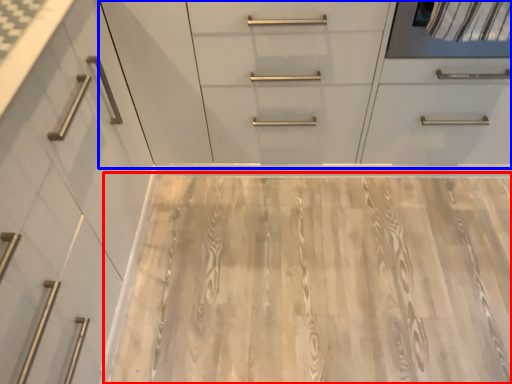
Question: Which point is further to the camera, plywood (highlighted by a red box) or dresser (highlighted by a blue box)?

Choices:
 (A) plywood
 (B) dresser

Answer: (A)